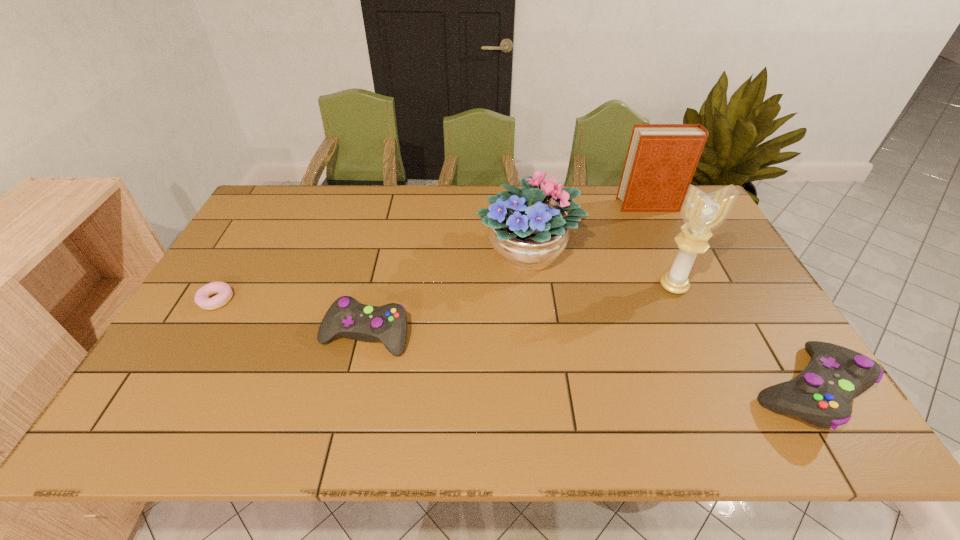
Locate an element on the screen. This screenshot has height=540, width=960. vacant space positioned on the back of the right control is located at coordinates (719, 245).

Identify the location of vacant space located 0.200m on the open cover of the farthest object. (561, 205).

Where is `free point located on the open cover of the farthest object`? The height and width of the screenshot is (540, 960). free point located on the open cover of the farthest object is located at coordinates (523, 205).

You are a GUI agent. You are given a task and a screenshot of the screen. Output one action in this format:
    pyautogui.click(x=<x>, y=<y>)
    Task: Click on the vacant space located 0.080m on the open cover of the farthest object
    This screenshot has height=540, width=960.
    Given the screenshot: What is the action you would take?
    pyautogui.click(x=595, y=205)

The image size is (960, 540). Find the location of `free space located 0.100m on the front of the bouquet`. free space located 0.100m on the front of the bouquet is located at coordinates (535, 315).

Image resolution: width=960 pixels, height=540 pixels. In order to click on free region located on the back of the leftmost object in this screenshot , I will do click(x=232, y=273).

The height and width of the screenshot is (540, 960). What are the coordinates of `vacant space located 0.280m on the front-facing side of the award` in the screenshot? It's located at (717, 384).

The image size is (960, 540). In order to click on hardback book that is positioned at the far edge in this screenshot , I will do point(661,160).

At what (x,y) coordinates should I click in order to perform the action: click on bouquet present at the far edge. Please return your answer as a coordinate pair (x, y). The height and width of the screenshot is (540, 960). Looking at the image, I should click on (528, 227).

The image size is (960, 540). I want to click on object present at the near edge, so pyautogui.click(x=821, y=395).